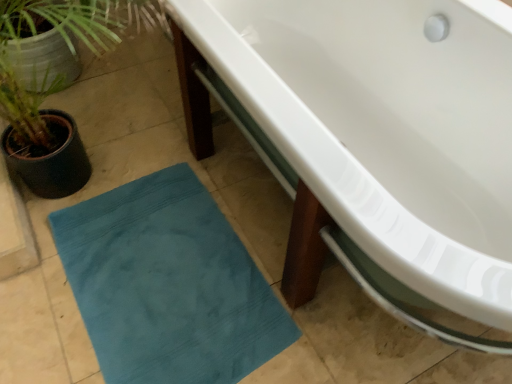
Question: Is white glossy bathtub at center wider or thinner than green textured plant at left?

Choices:
 (A) thin
 (B) wide

Answer: (B)

Question: Which is correct: white glossy bathtub at center is inside green textured plant at left, or outside of it?

Choices:
 (A) inside
 (B) outside

Answer: (B)

Question: Based on their relative distances, which object is nearer to the white glossy bathtub at center?

Choices:
 (A) green textured plant at left
 (B) teal fabric bath mat at lower left

Answer: (B)

Question: Based on their relative distances, which object is farther from the teal fabric bath mat at lower left?

Choices:
 (A) green textured plant at left
 (B) white glossy bathtub at center

Answer: (B)